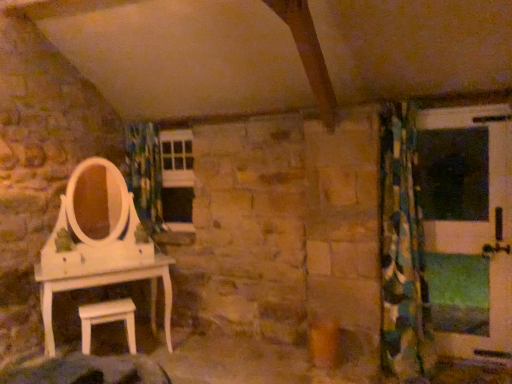
The image size is (512, 384). I want to click on free space above green matte screen door at right (from a real-world perspective), so click(x=453, y=116).